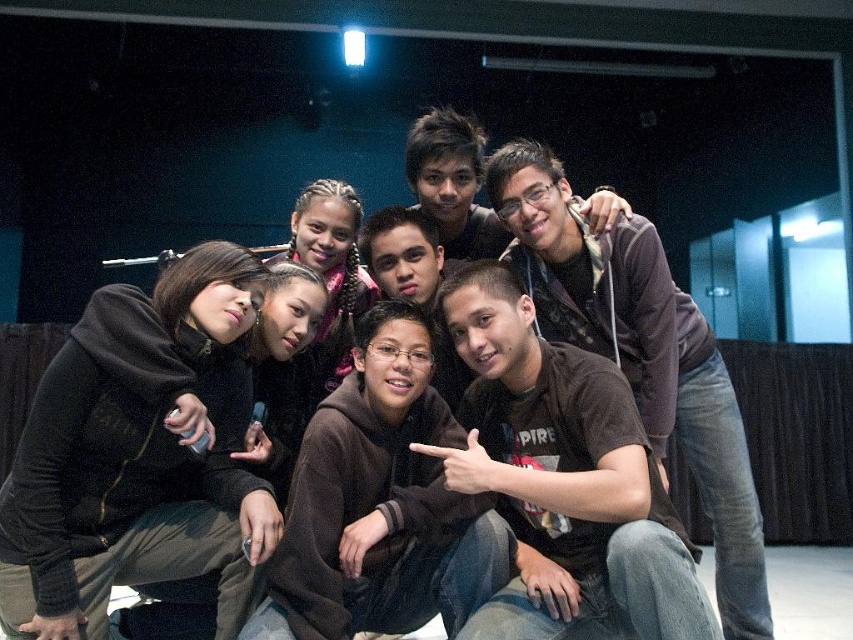
Question: Which of the following is the closest to the observer?

Choices:
 (A) brown matte shirt at center
 (B) brown hoodie at center
 (C) dark brown hoodie at lower left

Answer: (C)

Question: Estimate the real-world distances between objects in this image. Which object is farther from the brown hoodie at center?

Choices:
 (A) brown matte shirt at center
 (B) dark brown hoodie at lower left

Answer: (A)

Question: Can you confirm if brown hoodie at center is bigger than brown matte shirt at center?

Choices:
 (A) yes
 (B) no

Answer: (B)

Question: Does brown hoodie at center appear over brown matte shirt at center?

Choices:
 (A) yes
 (B) no

Answer: (B)

Question: Which of the following is the farthest from the observer?

Choices:
 (A) brown hoodie at center
 (B) brown matte shirt at center
 (C) dark brown hoodie at lower left

Answer: (B)

Question: Can you confirm if brown hoodie at center is positioned below brown matte shirt at center?

Choices:
 (A) no
 (B) yes

Answer: (B)